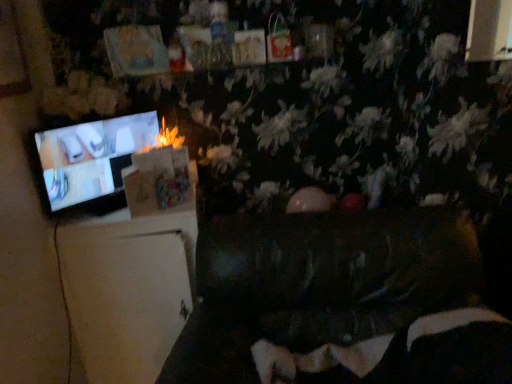
Question: From a real-world perspective, is matte black television at left over white matte refrigerator at left, arranged as the second furniture when viewed from the right?

Choices:
 (A) no
 (B) yes

Answer: (B)

Question: Considering the relative sizes of matte black television at left and white matte refrigerator at left, placed as the 1th furniture when sorted from left to right, in the image provided, is matte black television at left thinner than white matte refrigerator at left, placed as the 1th furniture when sorted from left to right,?

Choices:
 (A) no
 (B) yes

Answer: (B)

Question: Considering the relative sizes of matte black television at left and white matte refrigerator at left, arranged as the second furniture when viewed from the right, in the image provided, is matte black television at left bigger than white matte refrigerator at left, arranged as the second furniture when viewed from the right,?

Choices:
 (A) no
 (B) yes

Answer: (A)

Question: Is matte black television at left to the left of white matte refrigerator at left, placed as the 1th furniture when sorted from left to right, from the viewer's perspective?

Choices:
 (A) no
 (B) yes

Answer: (B)

Question: Does matte black television at left appear on the right side of white matte refrigerator at left, placed as the 1th furniture when sorted from left to right?

Choices:
 (A) no
 (B) yes

Answer: (A)

Question: Can you confirm if matte black television at left is shorter than white matte refrigerator at left, arranged as the second furniture when viewed from the right?

Choices:
 (A) no
 (B) yes

Answer: (B)

Question: From the image's perspective, is velvet black bean bag chair at lower center beneath white matte refrigerator at left, placed as the 1th furniture when sorted from left to right?

Choices:
 (A) yes
 (B) no

Answer: (A)

Question: Does velvet black bean bag chair at lower center have a lesser width compared to white matte refrigerator at left, arranged as the second furniture when viewed from the right?

Choices:
 (A) yes
 (B) no

Answer: (A)

Question: Does velvet black bean bag chair at lower center have a smaller size compared to white matte refrigerator at left, placed as the 1th furniture when sorted from left to right?

Choices:
 (A) yes
 (B) no

Answer: (A)

Question: Considering the relative sizes of velvet black bean bag chair at lower center and white matte refrigerator at left, arranged as the second furniture when viewed from the right, in the image provided, is velvet black bean bag chair at lower center wider than white matte refrigerator at left, arranged as the second furniture when viewed from the right,?

Choices:
 (A) no
 (B) yes

Answer: (A)

Question: Is velvet black bean bag chair at lower center looking in the opposite direction of white matte refrigerator at left, placed as the 1th furniture when sorted from left to right?

Choices:
 (A) yes
 (B) no

Answer: (B)

Question: From a real-world perspective, is velvet black bean bag chair at lower center physically below white matte refrigerator at left, placed as the 1th furniture when sorted from left to right?

Choices:
 (A) yes
 (B) no

Answer: (B)

Question: Considering the relative sizes of dark brown leather couch at center, marked as the 1th furniture in a right-to-left arrangement, and matte black television at left in the image provided, is dark brown leather couch at center, marked as the 1th furniture in a right-to-left arrangement, thinner than matte black television at left?

Choices:
 (A) yes
 (B) no

Answer: (B)